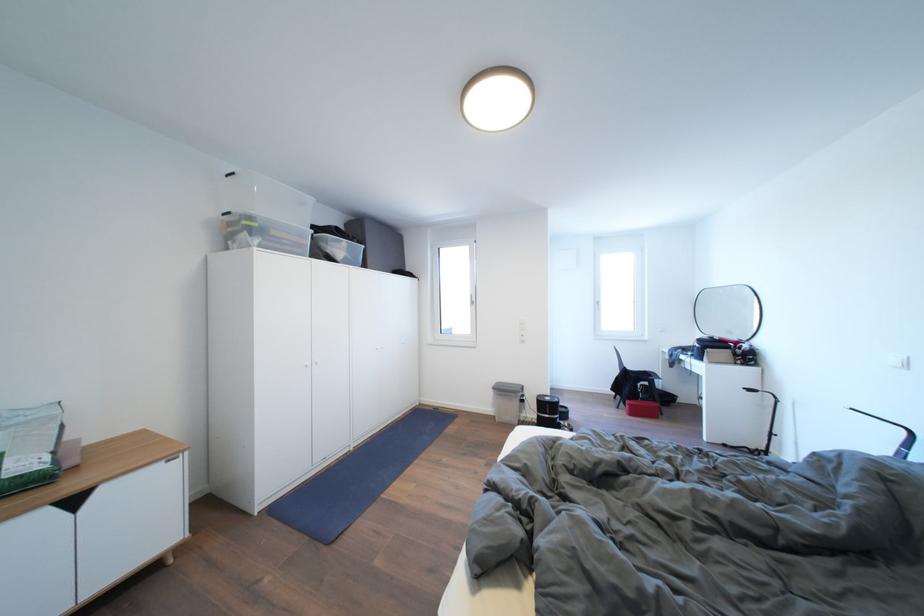
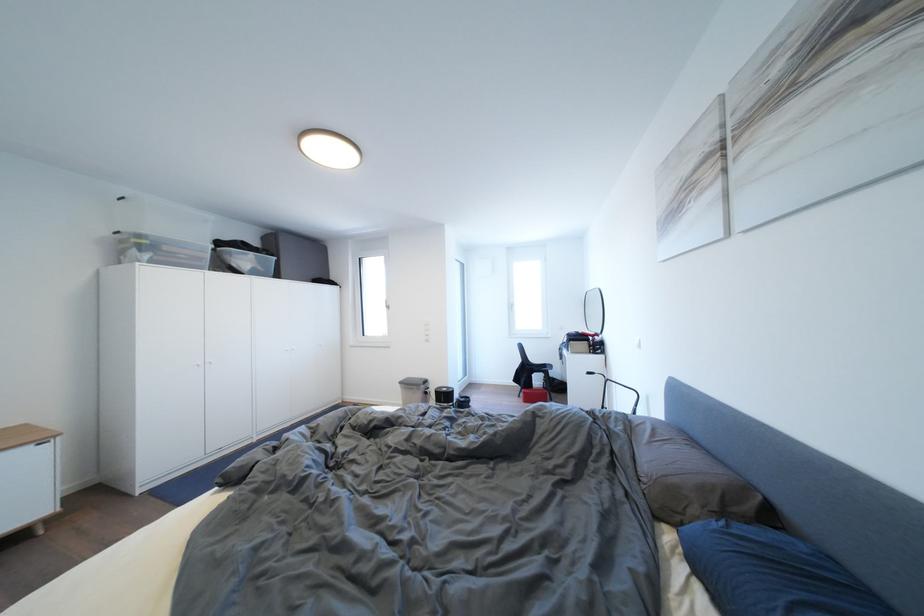
Locate, in the second image, the point that corresponds to the point at 334,246 in the first image.

(237, 259)